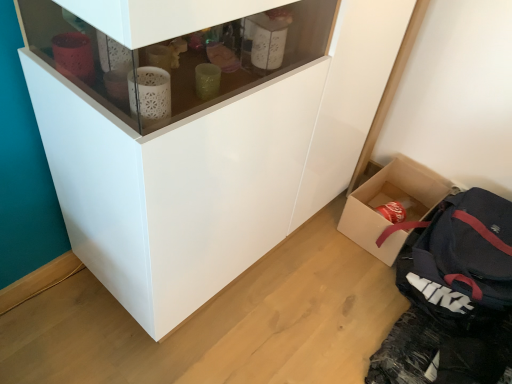
Question: From the image's perspective, is cardboard box at lower right below dark blue fabric backpack at lower right?

Choices:
 (A) yes
 (B) no

Answer: (B)

Question: Considering the relative sizes of cardboard box at lower right and dark blue fabric backpack at lower right in the image provided, is cardboard box at lower right wider than dark blue fabric backpack at lower right?

Choices:
 (A) yes
 (B) no

Answer: (B)

Question: Is the position of cardboard box at lower right less distant than that of dark blue fabric backpack at lower right?

Choices:
 (A) yes
 (B) no

Answer: (B)

Question: Are cardboard box at lower right and dark blue fabric backpack at lower right far apart?

Choices:
 (A) yes
 (B) no

Answer: (B)

Question: Can you confirm if cardboard box at lower right is thinner than dark blue fabric backpack at lower right?

Choices:
 (A) no
 (B) yes

Answer: (B)

Question: Based on their positions, is white glossy cupboard at center located to the left or right of cardboard box at lower right?

Choices:
 (A) right
 (B) left

Answer: (B)

Question: Is white glossy cupboard at center inside or outside of cardboard box at lower right?

Choices:
 (A) inside
 (B) outside

Answer: (B)

Question: Considering the positions of white glossy cupboard at center and cardboard box at lower right in the image, is white glossy cupboard at center wider or thinner than cardboard box at lower right?

Choices:
 (A) wide
 (B) thin

Answer: (A)

Question: In terms of size, does white glossy cupboard at center appear bigger or smaller than cardboard box at lower right?

Choices:
 (A) small
 (B) big

Answer: (B)

Question: Looking at the image, does dark blue fabric backpack at lower right seem bigger or smaller compared to white glossy cupboard at center?

Choices:
 (A) big
 (B) small

Answer: (B)

Question: Is point (459, 196) closer or farther from the camera than point (147, 228)?

Choices:
 (A) closer
 (B) farther

Answer: (B)

Question: In terms of width, does dark blue fabric backpack at lower right look wider or thinner when compared to white glossy cupboard at center?

Choices:
 (A) thin
 (B) wide

Answer: (B)

Question: In the image, is dark blue fabric backpack at lower right on the left side or the right side of white glossy cupboard at center?

Choices:
 (A) right
 (B) left

Answer: (A)

Question: From the image's perspective, is dark blue fabric backpack at lower right positioned above or below cardboard box at lower right?

Choices:
 (A) below
 (B) above

Answer: (A)

Question: Relative to cardboard box at lower right, is dark blue fabric backpack at lower right in front or behind?

Choices:
 (A) front
 (B) behind

Answer: (A)